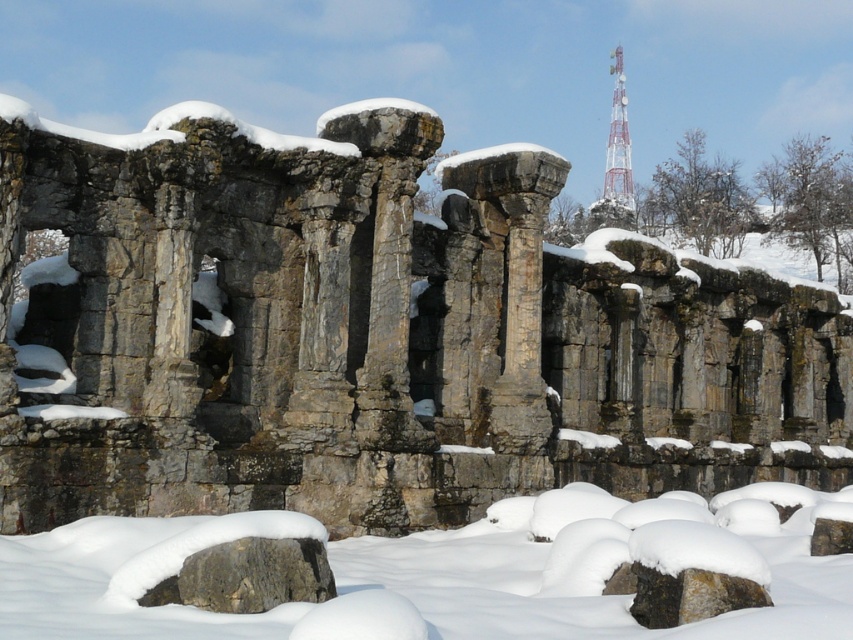
Question: Which object is farther from the camera taking this photo?

Choices:
 (A) white metallic tower at upper right
 (B) rusty stone columns at center
 (C) white fluffy snow at center

Answer: (A)

Question: Is white fluffy snow at center bigger than white metallic tower at upper right?

Choices:
 (A) no
 (B) yes

Answer: (A)

Question: Which point is closer to the camera?

Choices:
 (A) rusty stone columns at center
 (B) white fluffy snow at center
 (C) white metallic tower at upper right

Answer: (B)

Question: Which is nearer to the white fluffy snow at center?

Choices:
 (A) white metallic tower at upper right
 (B) rusty stone columns at center

Answer: (B)

Question: Does rusty stone columns at center appear on the left side of white metallic tower at upper right?

Choices:
 (A) no
 (B) yes

Answer: (B)

Question: Considering the relative positions of white fluffy snow at center and white metallic tower at upper right in the image provided, where is white fluffy snow at center located with respect to white metallic tower at upper right?

Choices:
 (A) left
 (B) right

Answer: (A)